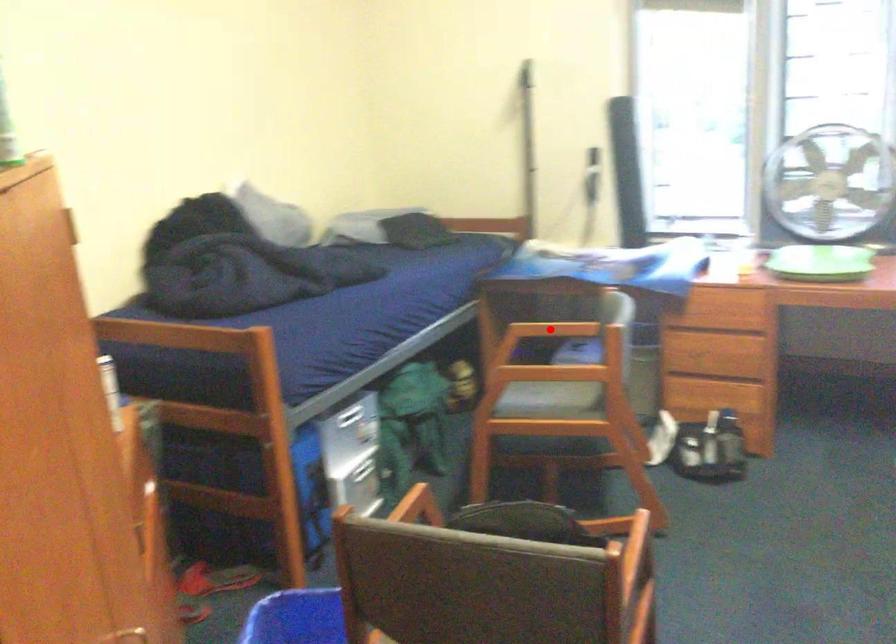
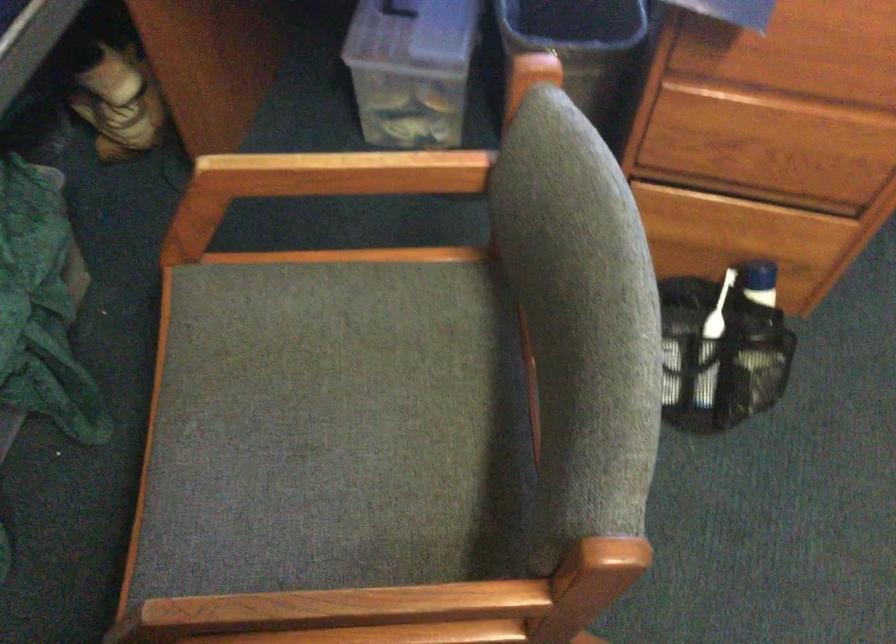
Find the pixel in the second image that matches the highlighted location in the first image.

(336, 174)